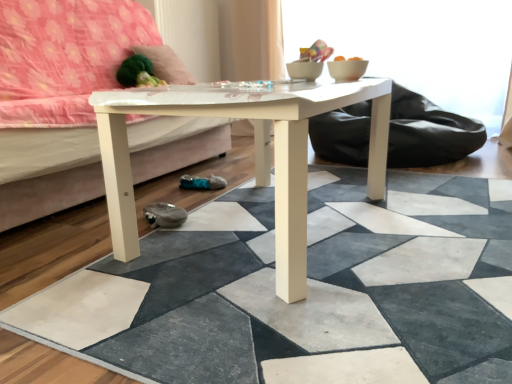
I want to click on vacant region above white matte tile at center (from a real-world perspective), so click(x=333, y=236).